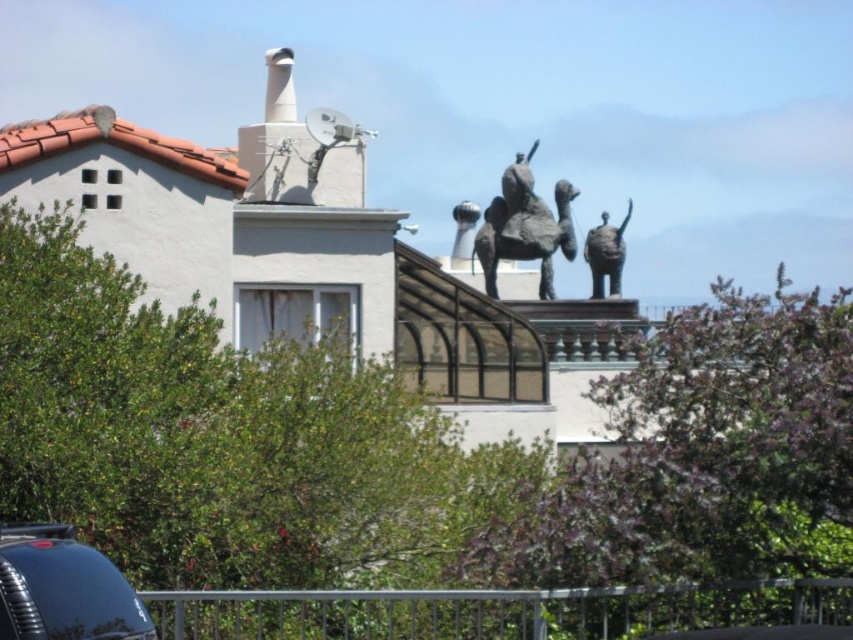
Question: Is bronze statue at upper center behind white glossy chimney at upper center?

Choices:
 (A) no
 (B) yes

Answer: (A)

Question: Observing the image, what is the correct spatial positioning of silver metallic rail at lower center in reference to white glossy chimney at upper center?

Choices:
 (A) right
 (B) left

Answer: (A)

Question: Does bronze statue at upper center appear over white glossy chimney at upper center?

Choices:
 (A) no
 (B) yes

Answer: (A)

Question: Which point is closer to the camera taking this photo?

Choices:
 (A) (289, 104)
 (B) (328, 589)

Answer: (B)

Question: Based on their relative distances, which object is nearer to the bronze statue at upper right?

Choices:
 (A) bronze statue at upper center
 (B) silver metallic rail at lower center
 (C) white glossy chimney at upper center

Answer: (A)

Question: Which of the following is the farthest from the observer?

Choices:
 (A) bronze statue at upper right
 (B) silver metallic rail at lower center
 (C) bronze statue at upper center

Answer: (A)